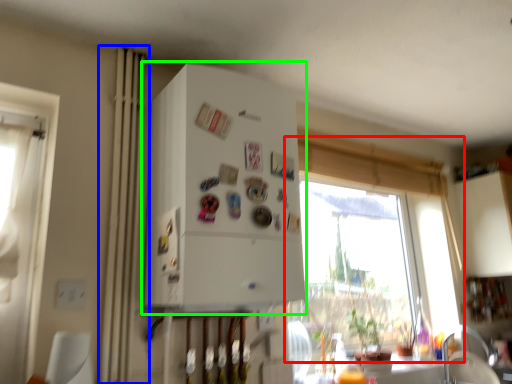
Question: Which is farther away from window (highlighted by a red box)? curtain (highlighted by a blue box) or appliance (highlighted by a green box)?

Choices:
 (A) curtain
 (B) appliance

Answer: (A)